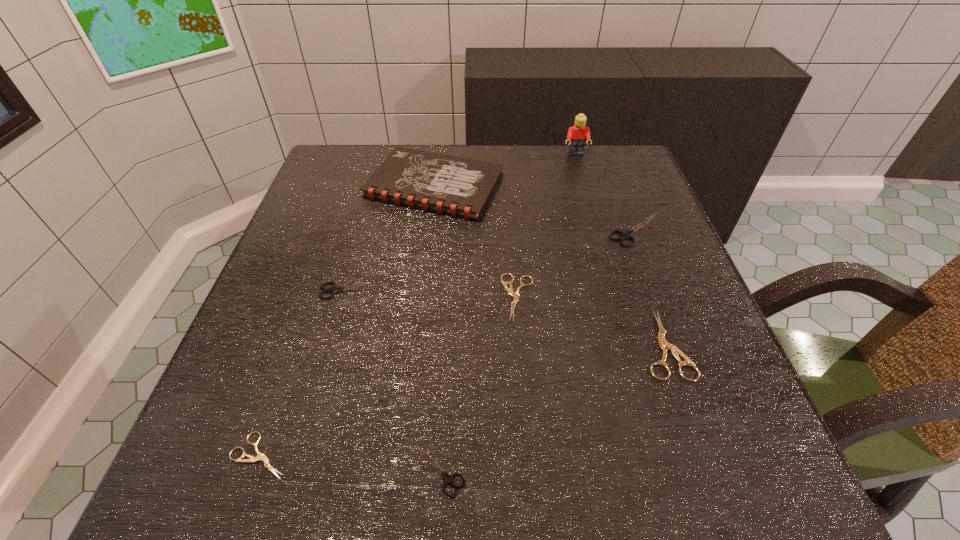
You are a GUI agent. You are given a task and a screenshot of the screen. Output one action in this format:
    pyautogui.click(x=<x>, y=<y>)
    Task: Click on the vacant space at the left edge
    The image size is (960, 540).
    Given the screenshot: What is the action you would take?
    pyautogui.click(x=329, y=218)

Where is `vacant space at the right edge`? This screenshot has height=540, width=960. vacant space at the right edge is located at coordinates (704, 326).

Image resolution: width=960 pixels, height=540 pixels. In order to click on free region at the far right corner of the desktop in this screenshot , I will do `click(589, 146)`.

Locate an element on the screen. The height and width of the screenshot is (540, 960). vacant region at the near right corner of the desktop is located at coordinates (692, 477).

You are a GUI agent. You are given a task and a screenshot of the screen. Output one action in this format:
    pyautogui.click(x=<x>, y=<y>)
    Task: Click on the empty location between the second tallest object and the smallest black shears
    This screenshot has height=540, width=960.
    Given the screenshot: What is the action you would take?
    pyautogui.click(x=437, y=328)

Find the location of a particular element. Image resolution: width=960 pixels, height=540 pixels. free space between the second biggest beige shears and the notebook is located at coordinates (476, 241).

The width and height of the screenshot is (960, 540). Identify the location of empty location between the second black shears from right to left and the leftmost beige shears. (349, 463).

The width and height of the screenshot is (960, 540). In order to click on free space between the tallest object and the rightmost beige shears in this screenshot , I will do 620,249.

Identify the location of free space between the smallest beige shears and the smallest black shears. (349, 463).

In order to click on vacant area that lies between the second tallest object and the leftmost beige shears in this screenshot , I will do `click(348, 320)`.